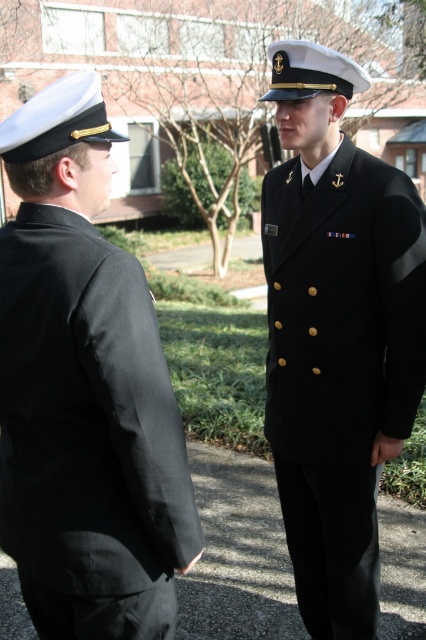
Question: Which point is closer to the camera?

Choices:
 (A) (77, 268)
 (B) (417, 304)

Answer: (A)

Question: Does black smooth uniform at left have a smaller size compared to black woolen jacket at center?

Choices:
 (A) yes
 (B) no

Answer: (A)

Question: Can you confirm if black smooth uniform at left is wider than black woolen jacket at center?

Choices:
 (A) yes
 (B) no

Answer: (B)

Question: Can you confirm if black smooth uniform at left is positioned to the left of black woolen jacket at center?

Choices:
 (A) no
 (B) yes

Answer: (B)

Question: Which point appears closest to the camera in this image?

Choices:
 (A) (20, 580)
 (B) (382, 163)

Answer: (A)